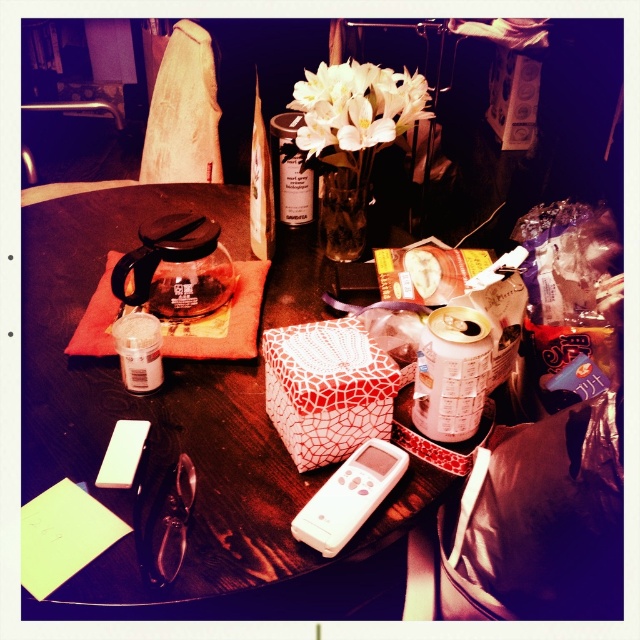
Can you confirm if white glossy flowers at center is wider than clear glass vase at upper center?

Yes, white glossy flowers at center is wider than clear glass vase at upper center.

Can you confirm if white glossy flowers at center is positioned below clear glass vase at upper center?

No, white glossy flowers at center is not below clear glass vase at upper center.

Is point (360, 99) farther from viewer compared to point (333, 204)?

That is False.

At what (x,y) coordinates should I click in order to perform the action: click on white glossy flowers at center. Please return your answer as a coordinate pair (x, y). Looking at the image, I should click on (356, 108).

Where is `wooden table at center`? The image size is (640, 640). wooden table at center is located at coordinates (170, 417).

The image size is (640, 640). What do you see at coordinates (170, 417) in the screenshot? I see `wooden table at center` at bounding box center [170, 417].

Locate an element on the screen. The height and width of the screenshot is (640, 640). wooden table at center is located at coordinates (170, 417).

Which is in front, point (304, 97) or point (369, 472)?

Point (369, 472)

Does white glossy flowers at center have a smaller size compared to white plastic remote at center?

Actually, white glossy flowers at center might be larger than white plastic remote at center.

Who is more distant from viewer, (428, 99) or (321, 547)?

The point (428, 99) is behind.

Locate an element on the screen. white glossy flowers at center is located at coordinates (356, 108).